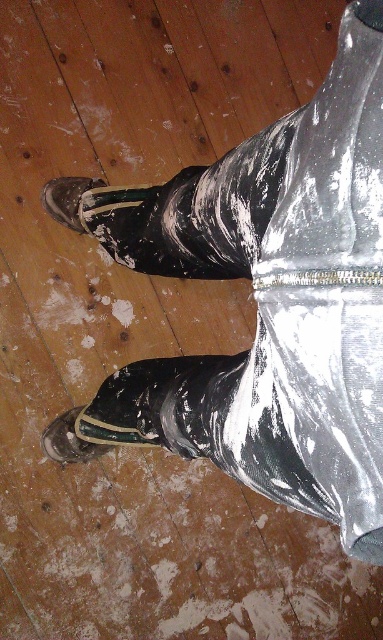
You are a painter who just finished a project and need to step onto the wooden floor. You see the shiny black shoe at lower left and the matte black shoe at lower left. Which shoe should you avoid stepping on to prevent slipping?

You should avoid stepping on the shiny black shoe at lower left because it is positioned under the matte black shoe at lower left, making it less stable and more likely to slip.

You are a painter observing the scene and need to step aside to let someone pass. Which shoe should you move first to avoid tripping them? The shiny black shoe at lower left or the matte black shoe at lower left?

The shiny black shoe at lower left is to the left of the matte black shoe at lower left, so you should move the shiny black shoe at lower left first to clear the path.